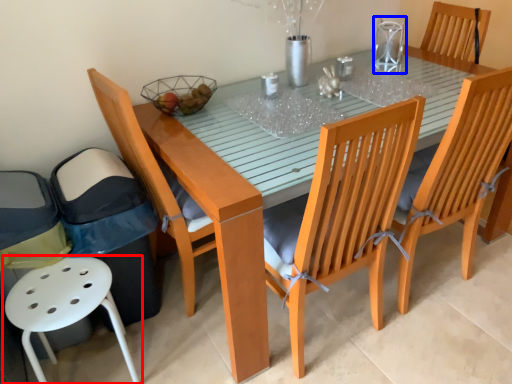
Question: Which point is further to the camera, chair (highlighted by a red box) or clear (highlighted by a blue box)?

Choices:
 (A) chair
 (B) clear

Answer: (B)